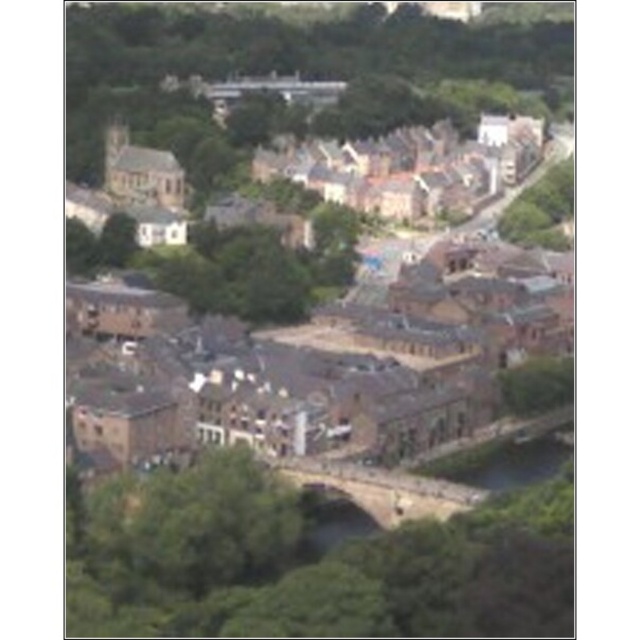
Question: Can you confirm if brown stone bridge at center is smaller than stone bridge at center?

Choices:
 (A) no
 (B) yes

Answer: (A)

Question: Does stone bridge at center have a smaller size compared to green grassy river at lower center?

Choices:
 (A) yes
 (B) no

Answer: (B)

Question: Which object is the closest to the brown stone bridge at center?

Choices:
 (A) green grassy river at lower center
 (B) brown stone buildings at center
 (C) stone bridge at center

Answer: (C)

Question: Among these objects, which one is farthest from the camera?

Choices:
 (A) green grassy river at lower center
 (B) stone bridge at center
 (C) brown stone buildings at center
 (D) brown stone bridge at center

Answer: (A)

Question: Does brown stone bridge at center appear over green grassy river at lower center?

Choices:
 (A) yes
 (B) no

Answer: (A)

Question: Which object is the farthest from the green grassy river at lower center?

Choices:
 (A) stone bridge at center
 (B) brown stone buildings at center

Answer: (B)